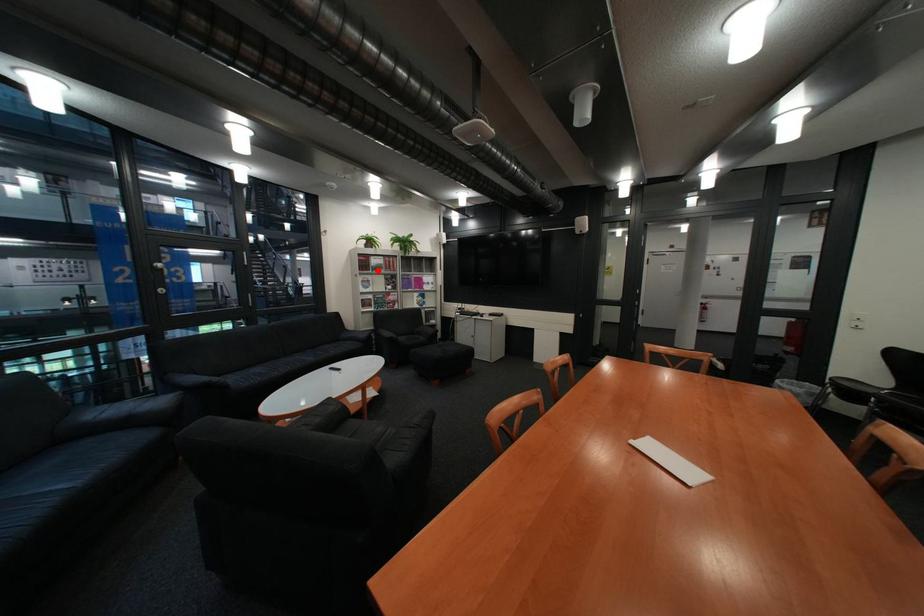
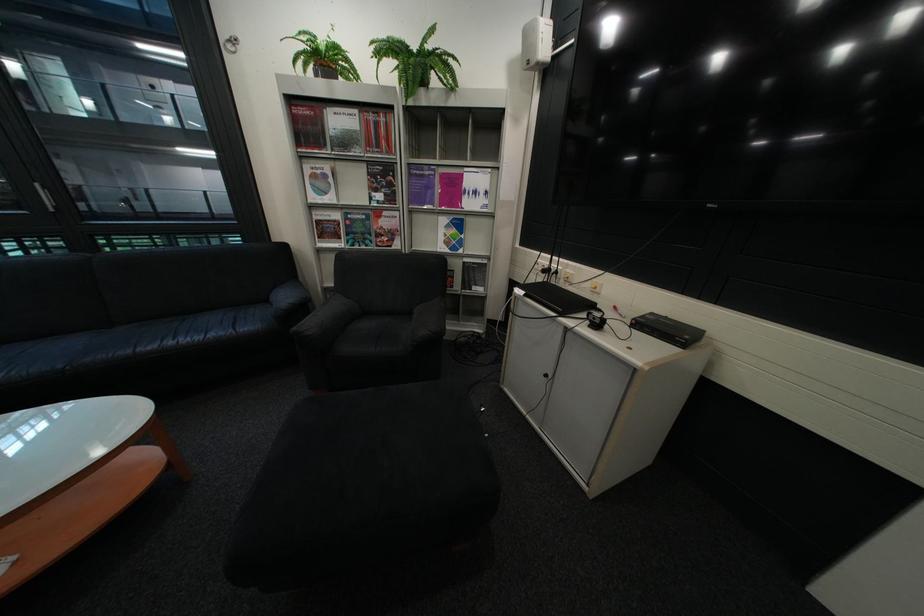
Where in the second image is the point corresponding to the highlighted location from the first image?

(322, 147)